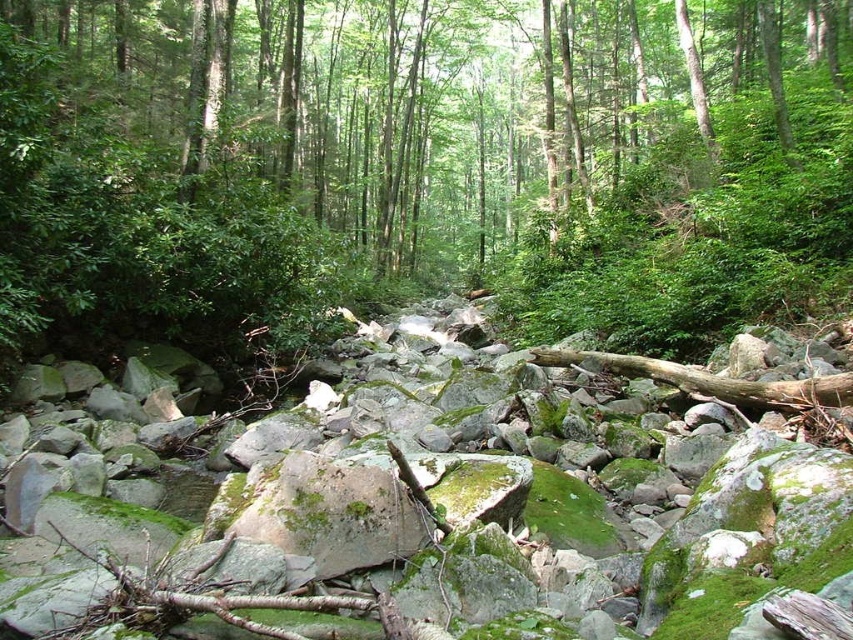
Is green mossy rock at center positioned before mossy rock at center?

That is False.

From the picture: Who is positioned more to the right, green mossy rock at center or mossy rock at center?

From the viewer's perspective, green mossy rock at center appears more on the right side.

Where is `green mossy rock at center`? green mossy rock at center is located at coordinates [447, 147].

This screenshot has height=640, width=853. I want to click on green mossy rock at center, so click(x=447, y=147).